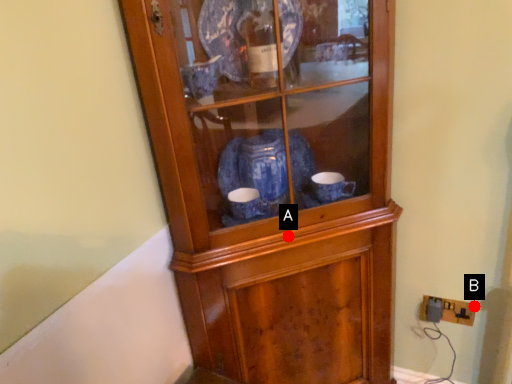
Question: Two points are circled on the image, labeled by A and B beside each circle. Which point is farther to the camera?

Choices:
 (A) A is further
 (B) B is further

Answer: (B)